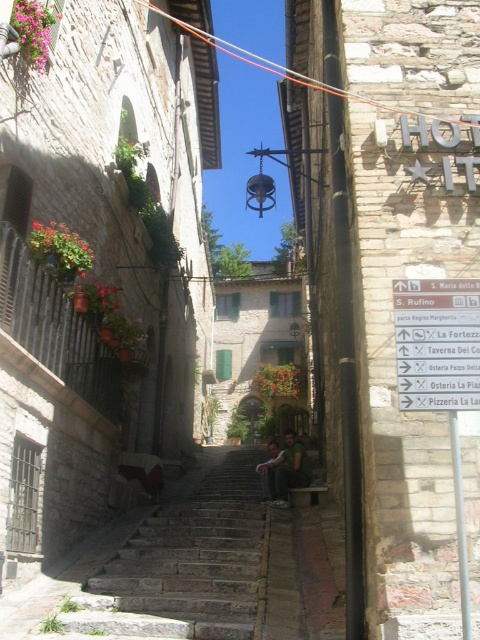
Measure the distance between point (467, 307) and camera.

Point (467, 307) and camera are 22.43 meters apart.

Is white plastic sign at center right taller than dark blue jeans at center?

Incorrect, white plastic sign at center right's height is not larger of dark blue jeans at center's.

Is point (406, 380) farther from camera compared to point (267, 483)?

That is False.

Where is `white plastic sign at center right`? The image size is (480, 640). white plastic sign at center right is located at coordinates (436, 342).

Can you confirm if stone stairs at center is positioned above green fabric shirt at center?

No, stone stairs at center is not above green fabric shirt at center.

What are the coordinates of `stone stairs at center` in the screenshot? It's located at (180, 566).

Identify the location of stone stairs at center. This screenshot has width=480, height=640. (180, 566).

What are the coordinates of `stone stairs at center` in the screenshot? It's located at (180, 566).

Is stone stairs at center to the right of white plastic sign at center right from the viewer's perspective?

In fact, stone stairs at center is to the left of white plastic sign at center right.

Between stone stairs at center and white plastic sign at center right, which one appears on the right side from the viewer's perspective?

From the viewer's perspective, white plastic sign at center right appears more on the right side.

You are a GUI agent. You are given a task and a screenshot of the screen. Output one action in this format:
    pyautogui.click(x=<x>, y=<y>)
    Task: Click on the stone stairs at center
    The height and width of the screenshot is (640, 480).
    Given the screenshot: What is the action you would take?
    180,566

At what (x,y) coordinates should I click in order to perform the action: click on stone stairs at center. Please return your answer as a coordinate pair (x, y). Looking at the image, I should click on (180, 566).